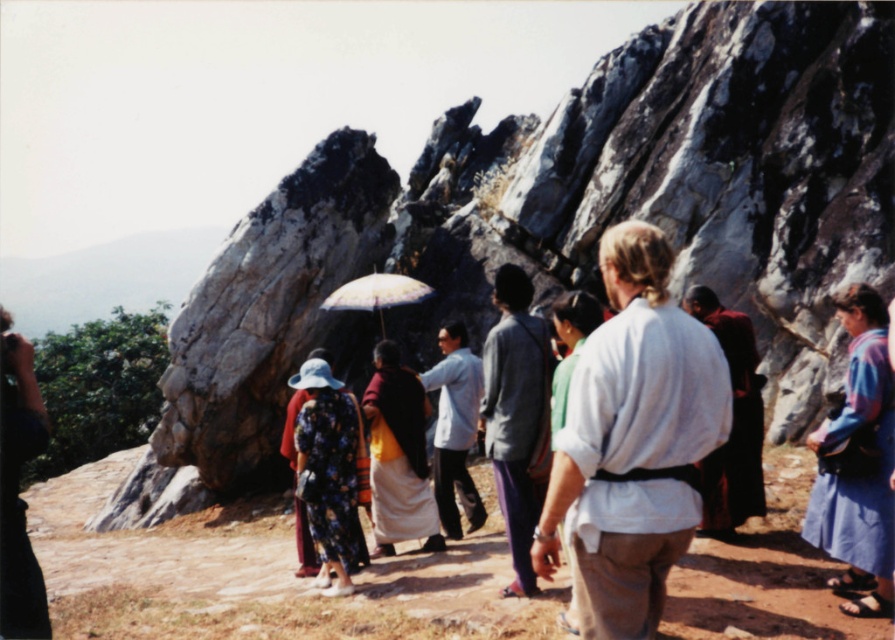
You are a photographer trying to capture both the gray cotton shirt at center and the maroon robe at center in the same frame. Based on their positions, which one is closer to the camera?

The gray cotton shirt at center is closer to the camera because the maroon robe at center is behind it.

You are a photographer positioned at the center of the dirt path in the image. You want to take a photo that includes both the yellow woolen robe at center and the light blue fabric shirt at center. Which direction should you move to ensure both are in frame?

The yellow woolen robe at center is to the left of the light blue fabric shirt at center. To capture both in the frame, you should position yourself between them, possibly moving slightly to the left to include the yellow woolen robe at center and the light blue fabric shirt at center in your shot.

You are organizing a group photo and need to arrange the gray cotton shirt at center and the maroon robe at center side by side. Which clothing item requires more horizontal space to accommodate its width?

The maroon robe at center requires more horizontal space because its width is greater than the gray cotton shirt at center.